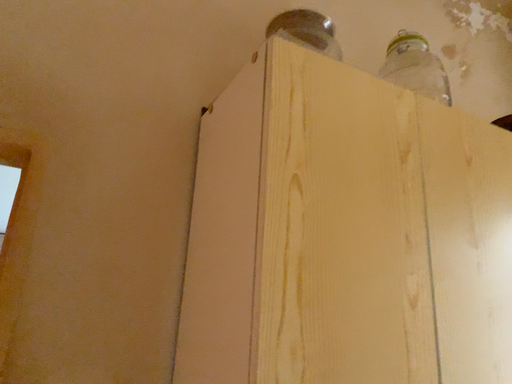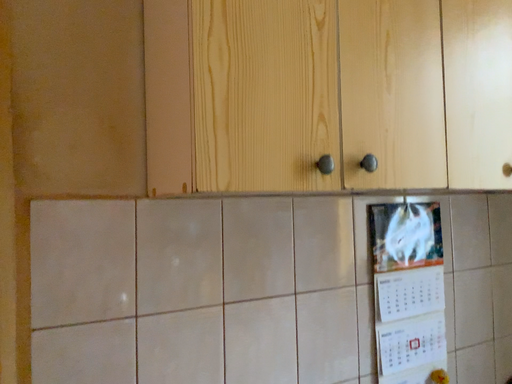
Question: Which way did the camera rotate in the video?

Choices:
 (A) rotated downward
 (B) rotated upward

Answer: (A)